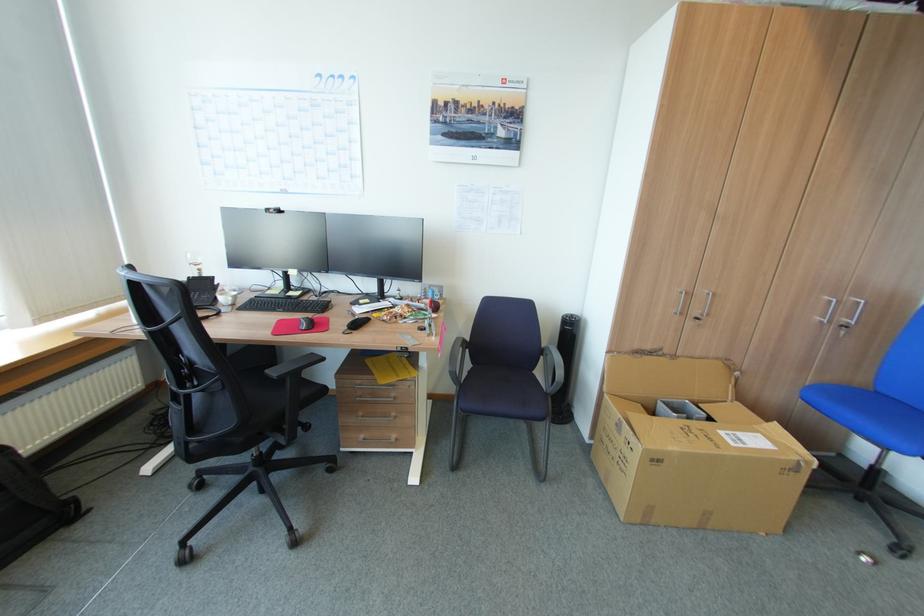
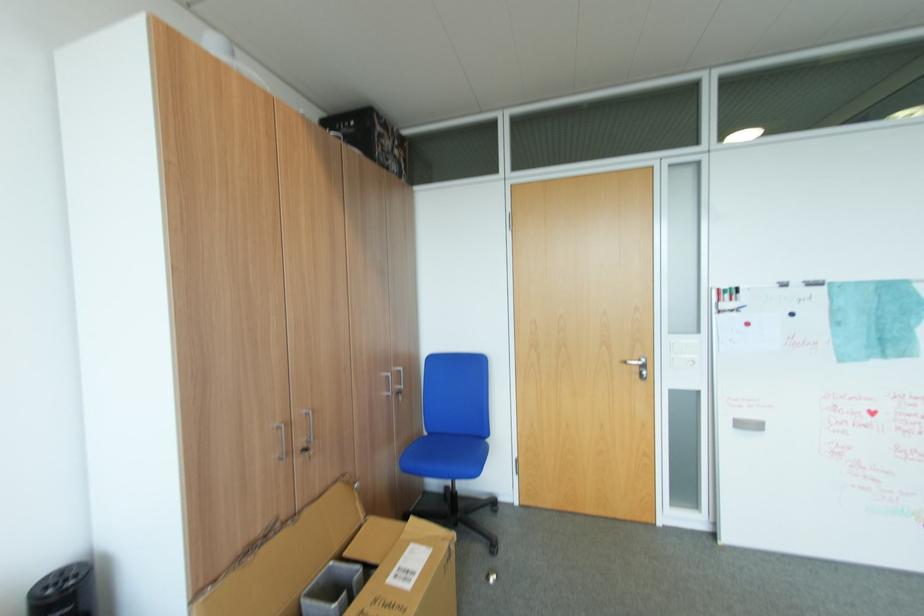
Find the pixel in the second image that matches pixel 701 318 in the first image.

(310, 451)